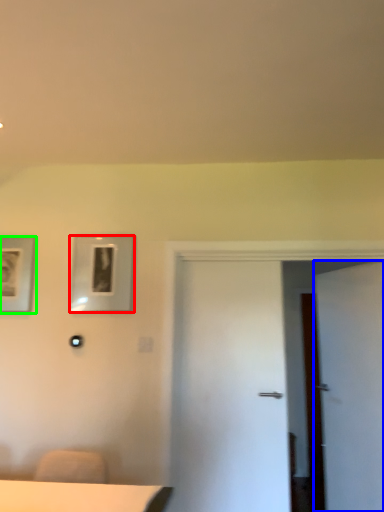
Question: Based on their relative distances, which object is farther from picture frame (highlighted by a red box)? Choose from door (highlighted by a blue box) and picture frame (highlighted by a green box).

Choices:
 (A) door
 (B) picture frame

Answer: (A)